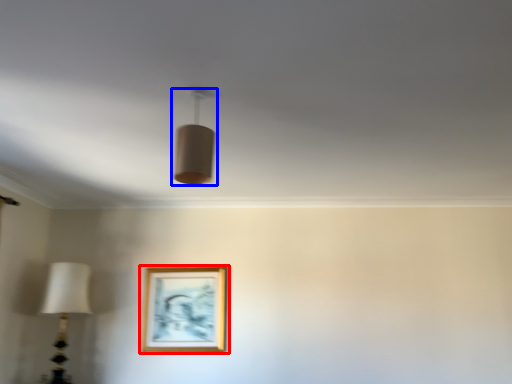
Question: Among these objects, which one is nearest to the camera, picture frame (highlighted by a red box) or lamp (highlighted by a blue box)?

Choices:
 (A) picture frame
 (B) lamp

Answer: (B)